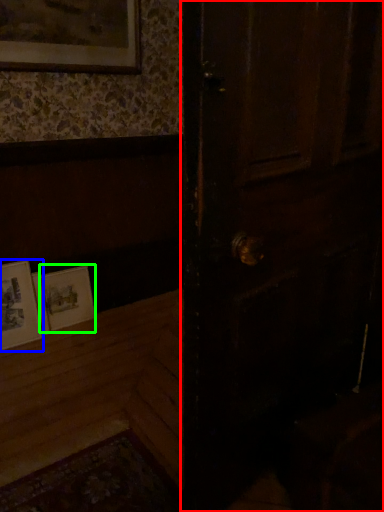
Question: Which object is positioned farthest from door (highlighted by a red box)? Select from picture frame (highlighted by a blue box) and picture frame (highlighted by a green box).

Choices:
 (A) picture frame
 (B) picture frame

Answer: (A)